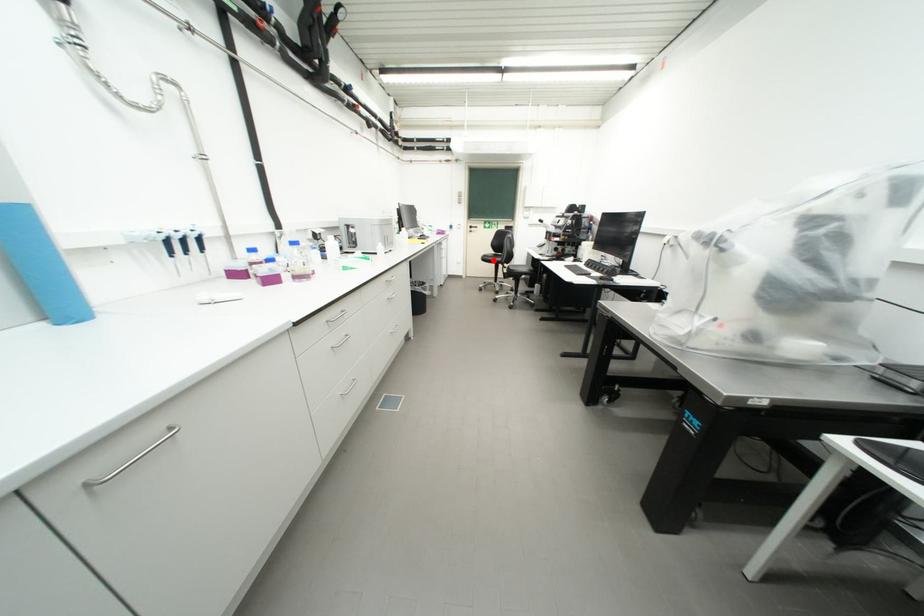
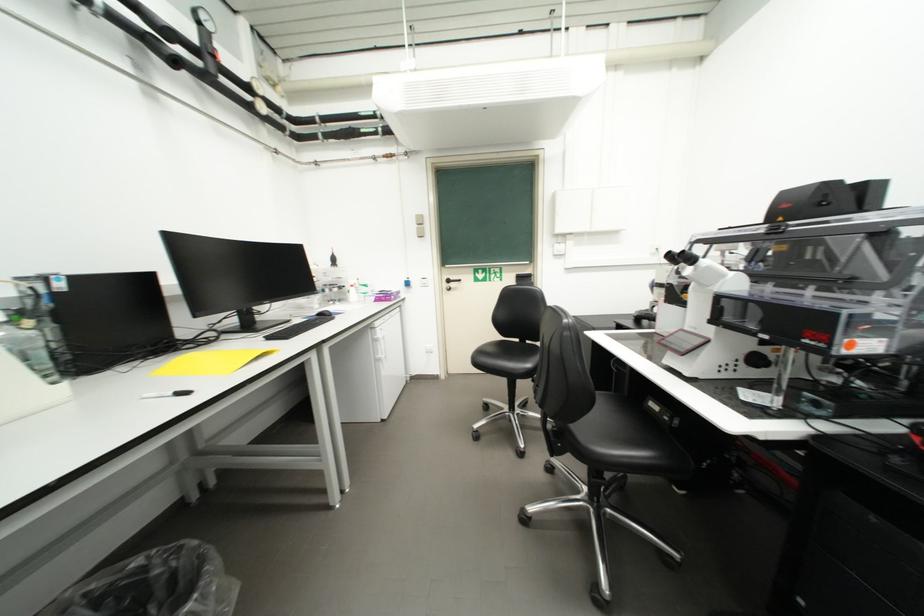
Question: I am providing you with two images of the same scene from different viewpoints. Image1 has a red point marked. In image2, the corresponding 3D location appears at what relative position? Reply with the corresponding letter.

Choices:
 (A) Closer
 (B) Farther

Answer: (B)